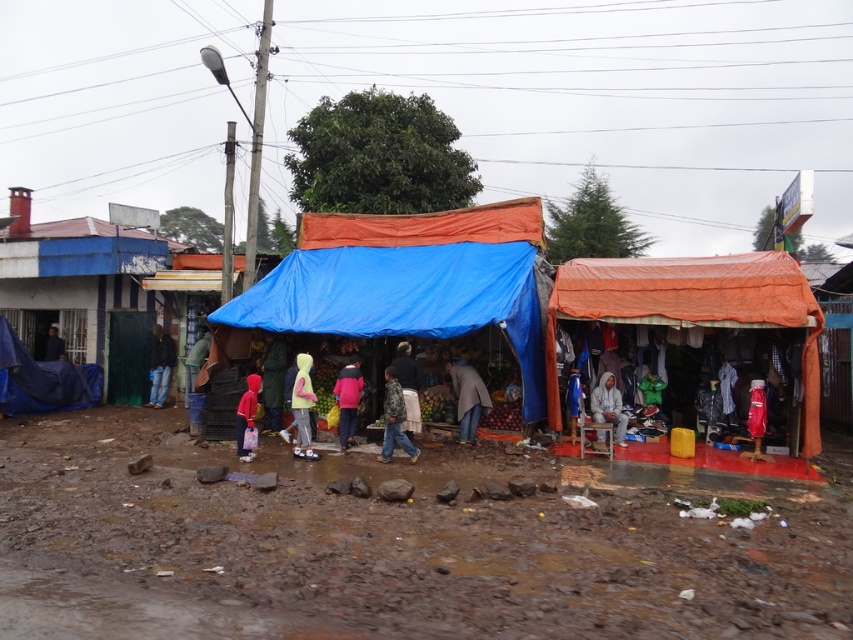
Question: Which point is farther to the camera?

Choices:
 (A) camouflage jacket at center
 (B) yellow matte jacket at center
 (C) light gray fabric jacket at center

Answer: (C)

Question: Does pink fabric at center appear over light gray fabric at center?

Choices:
 (A) no
 (B) yes

Answer: (B)

Question: Does blue tarpaulin hut at left appear on the left side of orange tarpaulin tent at right?

Choices:
 (A) no
 (B) yes

Answer: (B)

Question: Which object is positioned farthest from the light gray fabric jacket at center?

Choices:
 (A) green matte jacket at center
 (B) dark blue fabric at center
 (C) camouflage-patterned jacket at center

Answer: (B)

Question: Considering the real-world distances, which object is closest to the light gray fabric at center?

Choices:
 (A) camouflage jacket at center
 (B) dark blue fabric at center
 (C) yellow matte jacket at center
 (D) blue tarpaulin tent at center

Answer: (D)

Question: Does orange tarpaulin tent at right have a lesser width compared to yellow matte jacket at center?

Choices:
 (A) no
 (B) yes

Answer: (B)